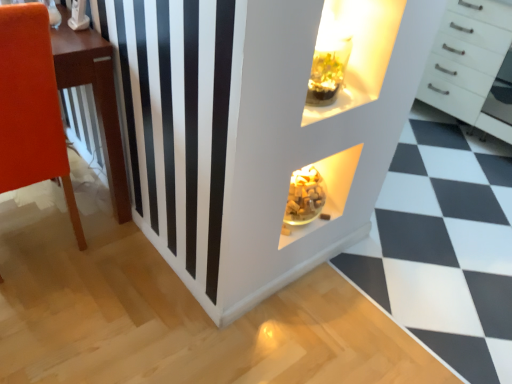
Question: Is white glossy dresser at center bigger than white glossy chest of drawers at upper right?

Choices:
 (A) yes
 (B) no

Answer: (B)

Question: Considering the relative sizes of white glossy dresser at center and white glossy chest of drawers at upper right in the image provided, is white glossy dresser at center shorter than white glossy chest of drawers at upper right?

Choices:
 (A) yes
 (B) no

Answer: (A)

Question: Is white glossy dresser at center beside white glossy chest of drawers at upper right?

Choices:
 (A) no
 (B) yes

Answer: (A)

Question: Is white glossy dresser at center not close to white glossy chest of drawers at upper right?

Choices:
 (A) yes
 (B) no

Answer: (A)

Question: From the image's perspective, does white glossy dresser at center appear higher than white glossy chest of drawers at upper right?

Choices:
 (A) no
 (B) yes

Answer: (A)

Question: Does white glossy dresser at center turn towards white glossy chest of drawers at upper right?

Choices:
 (A) yes
 (B) no

Answer: (B)

Question: Is white glossy chest of drawers at upper right far away from matte orange chair at left?

Choices:
 (A) yes
 (B) no

Answer: (A)

Question: Is white glossy chest of drawers at upper right at the left side of matte orange chair at left?

Choices:
 (A) yes
 (B) no

Answer: (B)

Question: Is white glossy chest of drawers at upper right with matte orange chair at left?

Choices:
 (A) no
 (B) yes

Answer: (A)

Question: From the image's perspective, does white glossy chest of drawers at upper right appear lower than matte orange chair at left?

Choices:
 (A) no
 (B) yes

Answer: (A)

Question: Considering the relative sizes of white glossy chest of drawers at upper right and matte orange chair at left in the image provided, is white glossy chest of drawers at upper right taller than matte orange chair at left?

Choices:
 (A) yes
 (B) no

Answer: (B)

Question: Is white glossy chest of drawers at upper right bigger than matte orange chair at left?

Choices:
 (A) no
 (B) yes

Answer: (B)

Question: Is matte orange chair at left oriented away from white glossy dresser at center?

Choices:
 (A) no
 (B) yes

Answer: (A)